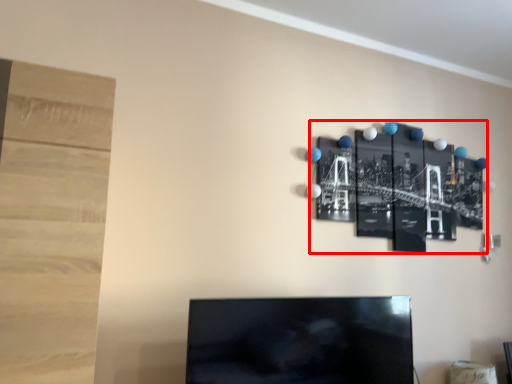
Question: From the image's perspective, where is bulletin board (annotated by the red box) located in relation to television in the image?

Choices:
 (A) below
 (B) above

Answer: (B)